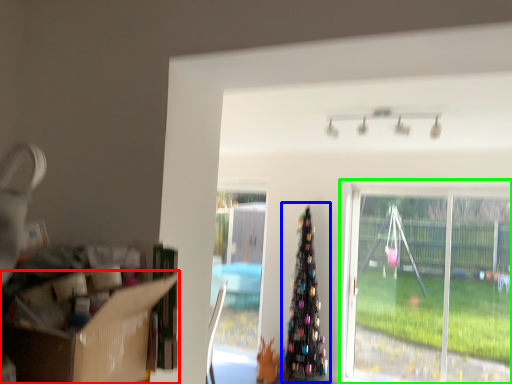
Question: Estimate the real-world distances between objects in this image. Which object is farther from cardboard box (highlighted by a red box), christmas tree (highlighted by a blue box) or window (highlighted by a green box)?

Choices:
 (A) christmas tree
 (B) window

Answer: (B)